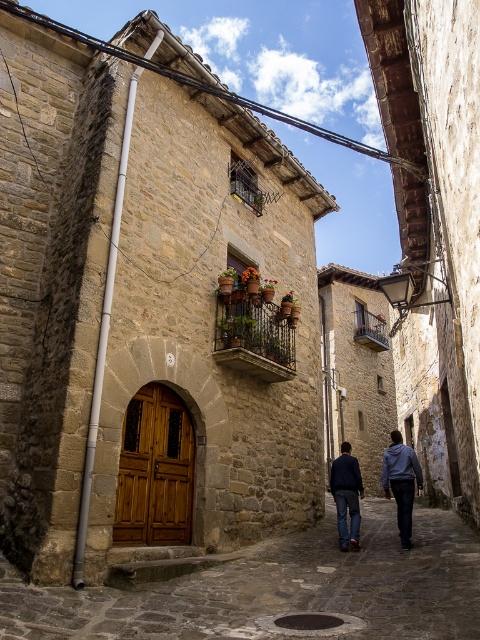
Question: Can you confirm if dark blue jeans at center is positioned above dark gray hoodie at center?

Choices:
 (A) yes
 (B) no

Answer: (A)

Question: Considering the real-world distances, which object is closest to the stone cobblestone alley at center?

Choices:
 (A) dark gray hoodie at center
 (B) dark blue jeans at center
 (C) dark blue denim jeans at center

Answer: (B)

Question: Does dark gray hoodie at center lie in front of dark blue denim jeans at center?

Choices:
 (A) no
 (B) yes

Answer: (B)

Question: Considering the real-world distances, which object is farthest from the dark blue jeans at center?

Choices:
 (A) stone cobblestone alley at center
 (B) dark blue denim jeans at center

Answer: (A)

Question: Which of the following is the farthest from the observer?

Choices:
 (A) (360, 492)
 (B) (310, 561)
 (C) (404, 509)
 (D) (395, 445)

Answer: (D)

Question: Is stone cobblestone alley at center in front of dark gray hoodie at center?

Choices:
 (A) no
 (B) yes

Answer: (B)